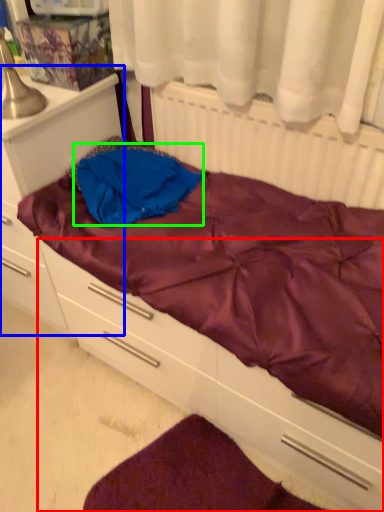
Question: Which object is positioned farthest from drawer (highlighted by a red box)? Select from file cabinet (highlighted by a blue box) and clothing (highlighted by a green box).

Choices:
 (A) file cabinet
 (B) clothing

Answer: (A)